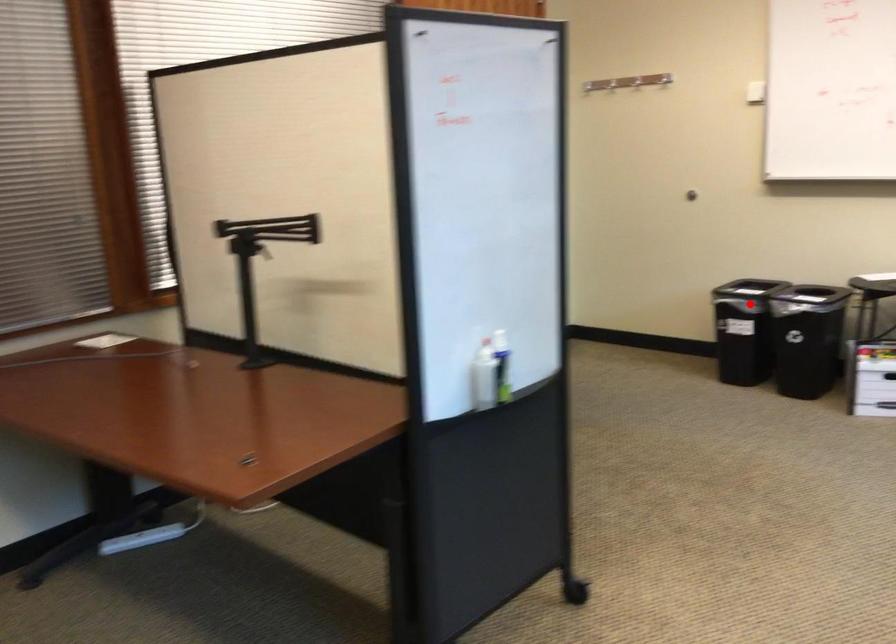
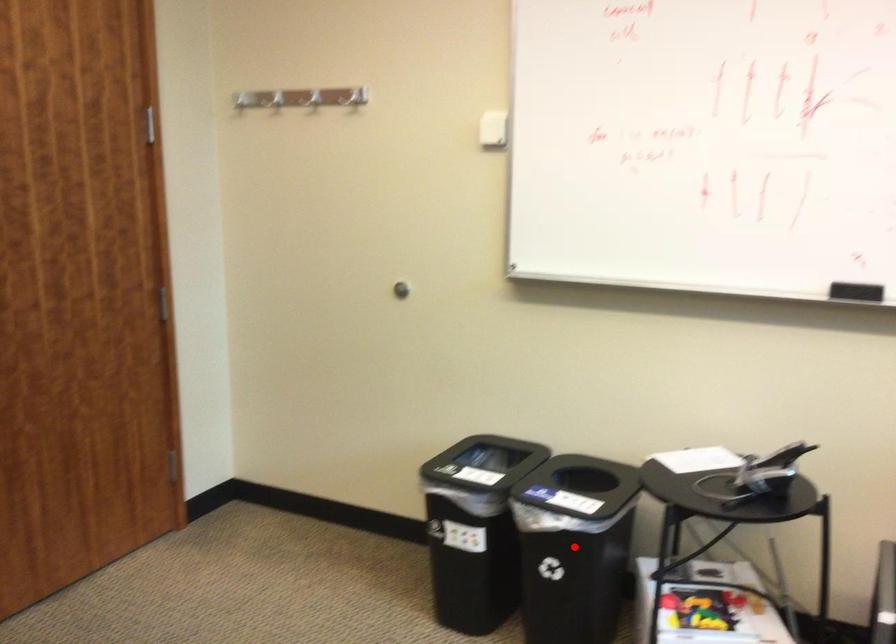
I am providing you with two images of the same scene from different viewpoints. A red point is marked on the first image and another point is marked on the second image. Is the marked point in image1 the same physical position as the marked point in image2?

Yes